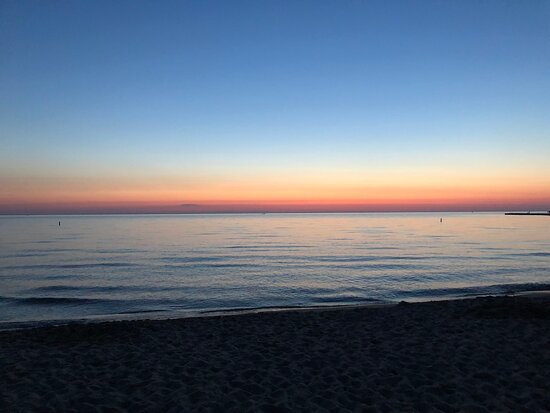
At what (x,y) coordinates should I click in order to perform the action: click on peninsula. Please return your answer as a coordinate pair (x, y). Looking at the image, I should click on (521, 214).